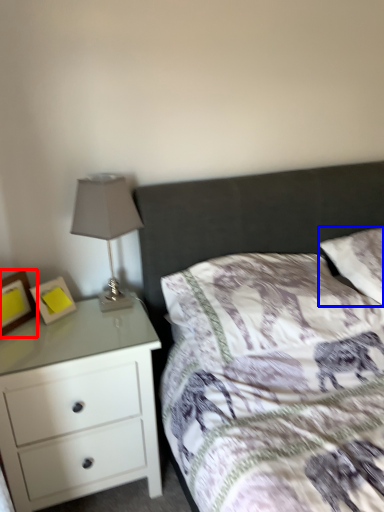
Question: Which object is closer to the camera taking this photo, picture frame (highlighted by a red box) or pillow (highlighted by a blue box)?

Choices:
 (A) picture frame
 (B) pillow

Answer: (A)